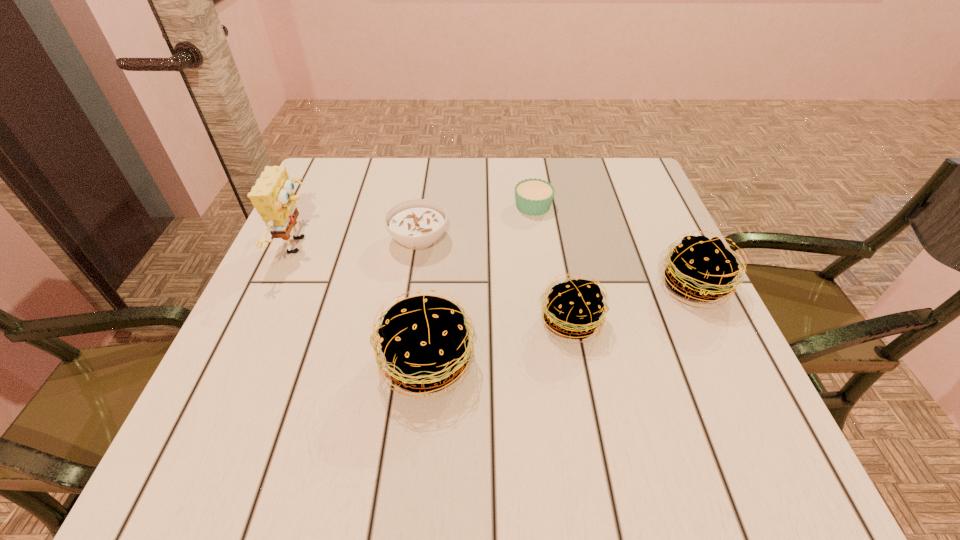
What are the coordinates of `empty space between the shortest patty and the leftmost patty` in the screenshot? It's located at (499, 342).

This screenshot has height=540, width=960. Find the location of `vacant area between the fifth tallest object and the leftmost object`. vacant area between the fifth tallest object and the leftmost object is located at coordinates (359, 242).

Find the location of a particular element. The image size is (960, 540). free area in between the second tallest patty and the second patty from left to right is located at coordinates (633, 303).

Locate an element on the screen. Image resolution: width=960 pixels, height=540 pixels. vacant area between the cupcake and the rightmost patty is located at coordinates (613, 246).

Locate which object is the closest to the second shortest object. Please provide its 2D coordinates. Your answer should be formatted as a tuple, i.e. [(x, y)], where the tuple contains the x and y coordinates of a point satisfying the conditions above.

[(534, 196)]

Identify which object is the second nearest to the leftmost patty. Please provide its 2D coordinates. Your answer should be formatted as a tuple, i.e. [(x, y)], where the tuple contains the x and y coordinates of a point satisfying the conditions above.

[(418, 223)]

The image size is (960, 540). I want to click on patty that can be found as the closest to the leftmost patty, so click(574, 307).

You are a GUI agent. You are given a task and a screenshot of the screen. Output one action in this format:
    pyautogui.click(x=<x>, y=<y>)
    Task: Click on the patty that is the second closest to the second shortest patty
    
    Given the screenshot: What is the action you would take?
    pyautogui.click(x=424, y=340)

The width and height of the screenshot is (960, 540). Find the location of `vacant point that satisfies the following two spatial constraints: 1. on the front side of the second shortest object; 2. on the right side of the third tallest object`. vacant point that satisfies the following two spatial constraints: 1. on the front side of the second shortest object; 2. on the right side of the third tallest object is located at coordinates (412, 286).

In order to click on blank area in the image that satisfies the following two spatial constraints: 1. on the face of the fourth tallest object; 2. on the left side of the leftmost object in this screenshot , I will do `click(266, 321)`.